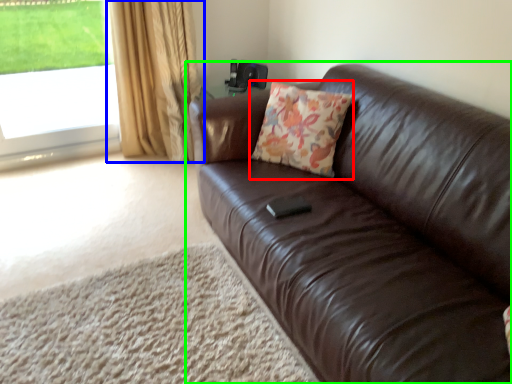
Question: Which is nearer to the throw pillow (highlighted by a red box)? curtain (highlighted by a blue box) or studio couch (highlighted by a green box).

Choices:
 (A) curtain
 (B) studio couch

Answer: (B)